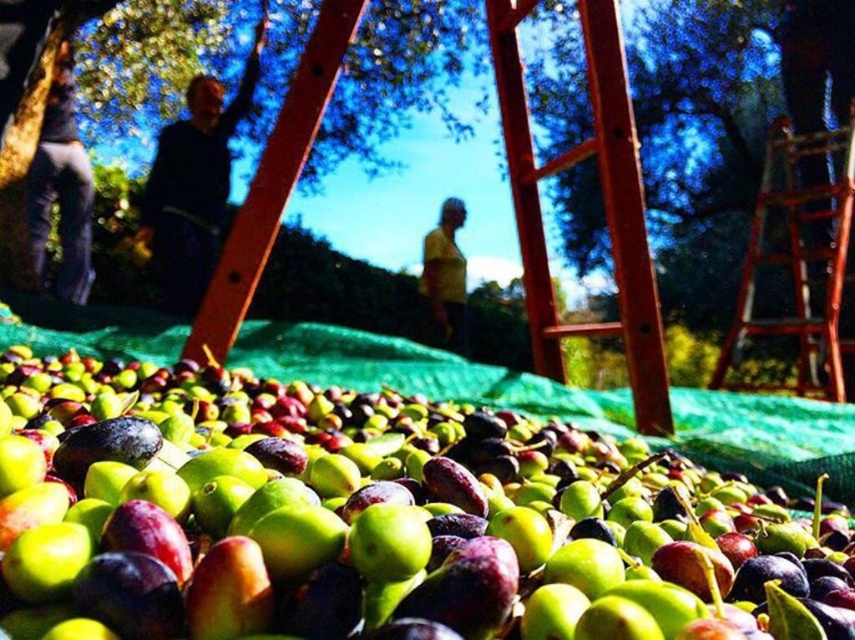
Based on the photo, you are a farmer checking the olives on the tarp. The olives are spread out in a grid pattern. The coordinates given are in a system where the bottom left corner is the origin. Can you confirm if the green matte olives at center are positioned closer to the top edge or the bottom edge of the tarp?

The green matte olives at center are located at point (376, 522). Since the y coordinate is 0.441, which is closer to 0.5, they are near the middle vertically. Therefore, they are neither closer to the top nor the bottom edge of the tarp.

You are standing at the center of the image and need to locate the dark blue sweater at upper left. According to the coordinates provided, in which direction should you look to find it?

The dark blue sweater at upper left is located at coordinates point (189, 193), which corresponds to the upper left direction from your current position at the center.